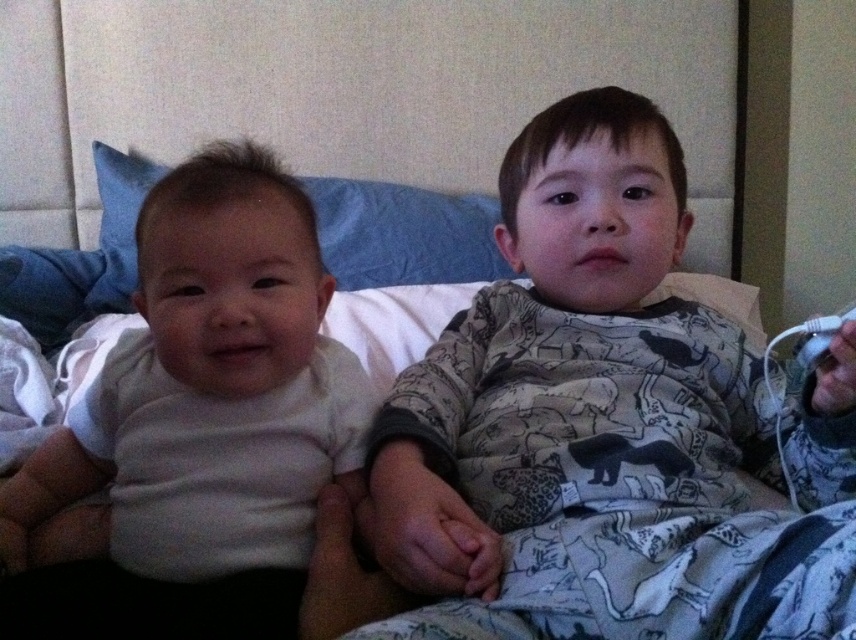
Question: Estimate the real-world distances between objects in this image. Which object is farther from the blue fabric pillow at upper left?

Choices:
 (A) printed cotton pajamas at center
 (B) white matte shirt at left

Answer: (B)

Question: In this image, where is printed cotton pajamas at center located relative to blue fabric pillow at upper left?

Choices:
 (A) above
 (B) below

Answer: (B)

Question: Estimate the real-world distances between objects in this image. Which object is farther from the white matte shirt at left?

Choices:
 (A) blue fabric pillow at upper left
 (B) printed cotton pajamas at center

Answer: (A)

Question: Does printed cotton pajamas at center come in front of white matte shirt at left?

Choices:
 (A) no
 (B) yes

Answer: (B)

Question: Does printed cotton pajamas at center appear under white matte shirt at left?

Choices:
 (A) yes
 (B) no

Answer: (B)

Question: Considering the real-world distances, which object is closest to the white matte shirt at left?

Choices:
 (A) printed cotton pajamas at center
 (B) blue fabric pillow at upper left

Answer: (A)